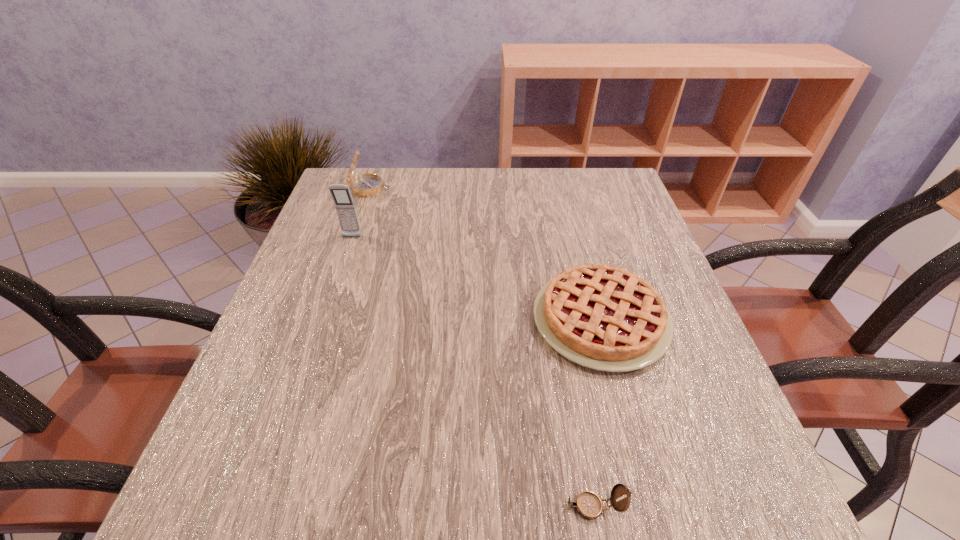
Identify the location of vacant area that lies between the nearer compass and the third farthest object. The height and width of the screenshot is (540, 960). (597, 413).

Where is `vacant space in between the taller compass and the pie`? The height and width of the screenshot is (540, 960). vacant space in between the taller compass and the pie is located at coordinates (485, 254).

Locate an element on the screen. empty space that is in between the shorter compass and the farther compass is located at coordinates (482, 347).

This screenshot has width=960, height=540. In order to click on free space that is in between the pie and the cellular telephone in this screenshot , I will do `click(476, 278)`.

You are a GUI agent. You are given a task and a screenshot of the screen. Output one action in this format:
    pyautogui.click(x=<x>, y=<y>)
    Task: Click on the object that is the third closest one to the farther compass
    The height and width of the screenshot is (540, 960).
    Given the screenshot: What is the action you would take?
    pyautogui.click(x=588, y=504)

The image size is (960, 540). What are the coordinates of `object that stands as the closest to the tallest object` in the screenshot? It's located at (364, 185).

Identify the location of vacant position in the image that satisfies the following two spatial constraints: 1. on the front-facing side of the pie; 2. on the left side of the second farthest object. (324, 320).

I want to click on free spot that satisfies the following two spatial constraints: 1. with the dial facing the left compass; 2. on the front-facing side of the cellular telephone, so click(x=353, y=237).

The image size is (960, 540). What are the coordinates of `vacant region that satisfies the following two spatial constraints: 1. on the back side of the pie; 2. with the dial facing the taller compass` in the screenshot? It's located at (565, 188).

Find the location of a particular element. The height and width of the screenshot is (540, 960). vacant position in the image that satisfies the following two spatial constraints: 1. with the dial facing the farthest object; 2. on the back side of the pie is located at coordinates (324, 320).